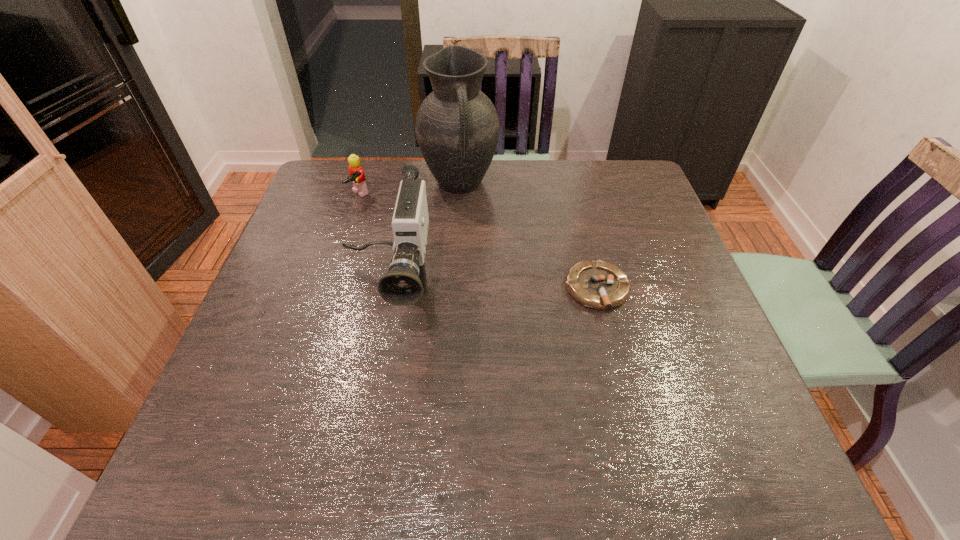
You are a GUI agent. You are given a task and a screenshot of the screen. Output one action in this format:
    pyautogui.click(x=<x>, y=<y>)
    Task: Click on the camcorder
    
    Given the screenshot: What is the action you would take?
    pyautogui.click(x=404, y=284)

Locate an element on the screen. Image resolution: width=960 pixels, height=540 pixels. ashtray is located at coordinates (599, 285).

The height and width of the screenshot is (540, 960). Identify the location of the rightmost object. (599, 285).

Where is `the tallest object`? the tallest object is located at coordinates (457, 129).

This screenshot has width=960, height=540. I want to click on the second shortest object, so click(357, 177).

Identify the location of free space located on the recording direction of the second tallest object. This screenshot has width=960, height=540. coord(365,408).

This screenshot has height=540, width=960. Identify the location of vacant area situated on the left of the ashtray. (456, 289).

At what (x,y) coordinates should I click in order to perform the action: click on blank space located on the side of the pitcher with the handle. Please return your answer as a coordinate pair (x, y). Image resolution: width=960 pixels, height=540 pixels. Looking at the image, I should click on (481, 267).

Identify the location of free space located 0.340m on the side of the pitcher with the handle. This screenshot has width=960, height=540. (489, 296).

Find the location of a particular element. free space located 0.280m on the side of the pitcher with the handle is located at coordinates (484, 278).